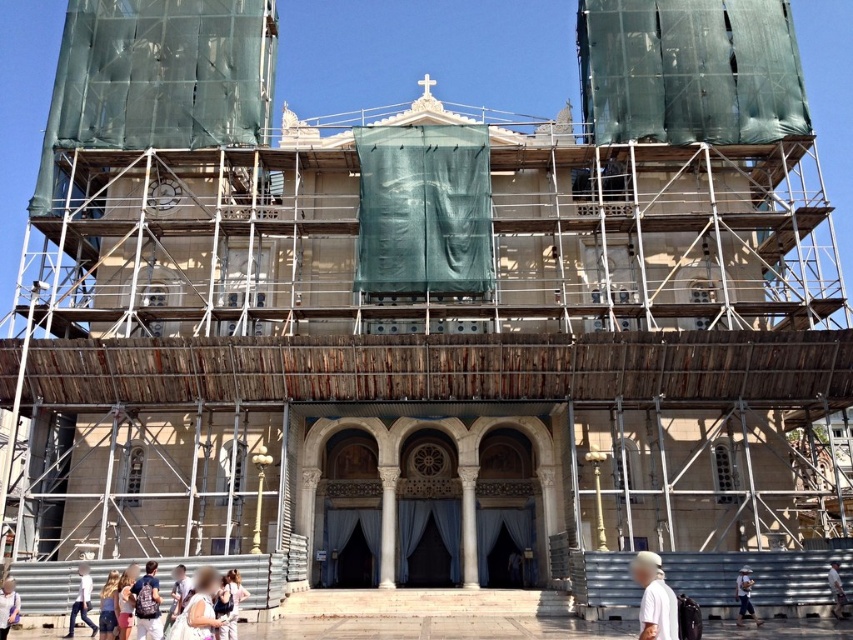
Does point (660, 636) lie behind point (9, 589)?

That is False.

You are a GUI agent. You are given a task and a screenshot of the screen. Output one action in this format:
    pyautogui.click(x=<x>, y=<y>)
    Task: Click on the white matte shirt at lower right
    The image size is (853, 640).
    Given the screenshot: What is the action you would take?
    pyautogui.click(x=654, y=598)

Locate an element on the screen. The width and height of the screenshot is (853, 640). white matte shirt at lower right is located at coordinates (654, 598).

Is white cotton dress at center wider than white cotton shirt at center?

Yes.

Between white cotton dress at center and white cotton shirt at center, which one appears on the right side from the viewer's perspective?

white cotton shirt at center

Between point (196, 632) and point (751, 582), which one is positioned behind?

The point (751, 582) is behind.

At what (x,y) coordinates should I click in order to perform the action: click on white cotton dress at center. Please return your answer as a coordinate pair (x, y). Image resolution: width=853 pixels, height=640 pixels. Looking at the image, I should click on (201, 605).

Is dark blue backpack at center thinner than white cotton shirt at lower right?

No.

Can you confirm if dark blue backpack at center is positioned to the right of white cotton shirt at lower right?

Incorrect, dark blue backpack at center is not on the right side of white cotton shirt at lower right.

Between point (149, 570) and point (839, 586), which one is positioned in front?

Positioned in front is point (149, 570).

Image resolution: width=853 pixels, height=640 pixels. I want to click on dark blue backpack at center, so click(148, 604).